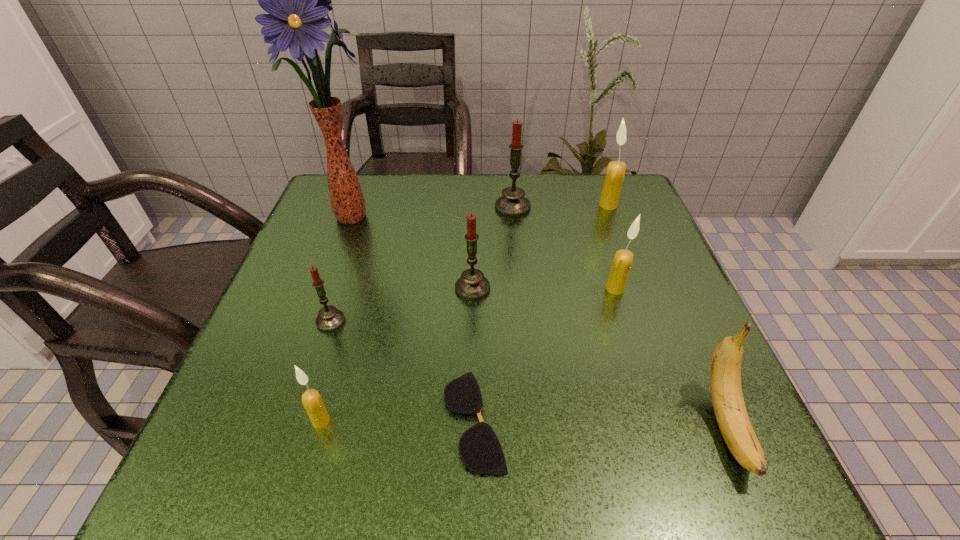
This screenshot has width=960, height=540. I want to click on yellow banana, so click(x=725, y=370).

Image resolution: width=960 pixels, height=540 pixels. I want to click on banana, so click(725, 370).

Find the location of a particular element. The height and width of the screenshot is (540, 960). the second nearest candle is located at coordinates (329, 319).

Where is `the leftmost red candle`? the leftmost red candle is located at coordinates (329, 319).

Where is `the smallest cream candle`? Image resolution: width=960 pixels, height=540 pixels. the smallest cream candle is located at coordinates (311, 399).

Find the location of `the nearest cream candle`. the nearest cream candle is located at coordinates (311, 399).

You are a GUI agent. You are given a task and a screenshot of the screen. Output one action in this format:
    pyautogui.click(x=<x>, y=<y>)
    Task: Click on the spectacles
    This screenshot has width=960, height=540.
    Given the screenshot: What is the action you would take?
    pyautogui.click(x=479, y=447)

Where is `free space located 0.080m on the back of the purple flower arrangement`? free space located 0.080m on the back of the purple flower arrangement is located at coordinates (366, 173).

Where is `free space located on the front of the farthest red candle`? The width and height of the screenshot is (960, 540). free space located on the front of the farthest red candle is located at coordinates (516, 235).

The image size is (960, 540). What are the coordinates of `free space located 0.100m on the front of the eighth object from left to right` in the screenshot? It's located at (619, 235).